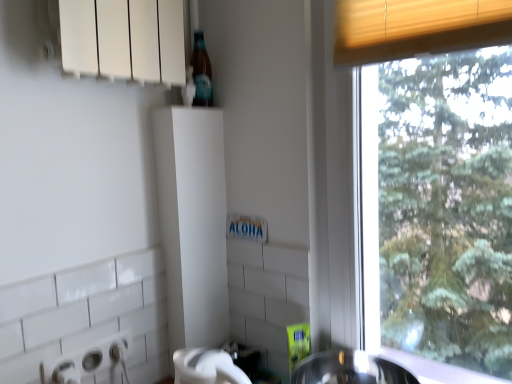
Question: Considering the relative sizes of white plastic bottle at upper center and translucent glass bottle at upper center in the image provided, is white plastic bottle at upper center taller than translucent glass bottle at upper center?

Choices:
 (A) no
 (B) yes

Answer: (B)

Question: From a real-world perspective, is white plastic bottle at upper center under translucent glass bottle at upper center?

Choices:
 (A) yes
 (B) no

Answer: (B)

Question: Considering the relative sizes of white plastic bottle at upper center and translucent glass bottle at upper center in the image provided, is white plastic bottle at upper center thinner than translucent glass bottle at upper center?

Choices:
 (A) no
 (B) yes

Answer: (A)

Question: Is white plastic bottle at upper center to the right of translucent glass bottle at upper center from the viewer's perspective?

Choices:
 (A) yes
 (B) no

Answer: (B)

Question: From the image's perspective, does white plastic bottle at upper center appear lower than translucent glass bottle at upper center?

Choices:
 (A) no
 (B) yes

Answer: (A)

Question: From the image's perspective, is white plastic bottle at upper center located above or below translucent glass bottle at upper center?

Choices:
 (A) below
 (B) above

Answer: (B)

Question: In terms of width, does white plastic bottle at upper center look wider or thinner when compared to translucent glass bottle at upper center?

Choices:
 (A) wide
 (B) thin

Answer: (A)

Question: Considering the relative positions of white plastic bottle at upper center and translucent glass bottle at upper center in the image provided, is white plastic bottle at upper center to the left or to the right of translucent glass bottle at upper center?

Choices:
 (A) right
 (B) left

Answer: (B)

Question: Is white plastic bottle at upper center inside or outside of translucent glass bottle at upper center?

Choices:
 (A) inside
 (B) outside

Answer: (B)

Question: From the image's perspective, relative to white plastic bottle at upper center, is shiny metallic sink at lower center above or below?

Choices:
 (A) above
 (B) below

Answer: (B)

Question: Which is correct: shiny metallic sink at lower center is inside white plastic bottle at upper center, or outside of it?

Choices:
 (A) inside
 (B) outside

Answer: (B)

Question: Considering the positions of shiny metallic sink at lower center and white plastic bottle at upper center in the image, is shiny metallic sink at lower center taller or shorter than white plastic bottle at upper center?

Choices:
 (A) short
 (B) tall

Answer: (A)

Question: From a real-world perspective, is shiny metallic sink at lower center above or below white plastic bottle at upper center?

Choices:
 (A) above
 (B) below

Answer: (B)

Question: Looking at their shapes, would you say shiny metallic sink at lower center is wider or thinner than translucent glass bottle at upper center?

Choices:
 (A) thin
 (B) wide

Answer: (B)

Question: Is shiny metallic sink at lower center to the left or to the right of translucent glass bottle at upper center in the image?

Choices:
 (A) left
 (B) right

Answer: (B)